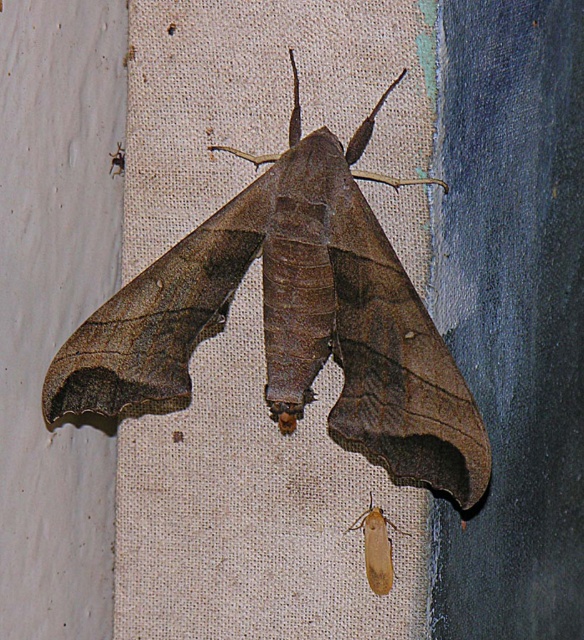
Question: Which object is closer to the camera taking this photo?

Choices:
 (A) brown matte moth at center
 (B) light brown fuzzy moth at lower right

Answer: (A)

Question: Observing the image, what is the correct spatial positioning of brown matte moth at center in reference to light brown fuzzy moth at lower right?

Choices:
 (A) above
 (B) below

Answer: (A)

Question: Can you confirm if brown matte moth at center is wider than light brown fuzzy moth at lower right?

Choices:
 (A) no
 (B) yes

Answer: (B)

Question: Which point appears farthest from the camera in this image?

Choices:
 (A) (363, 529)
 (B) (307, 152)

Answer: (A)

Question: Does brown matte moth at center appear on the right side of light brown fuzzy moth at lower right?

Choices:
 (A) no
 (B) yes

Answer: (A)

Question: Which of the following is the closest to the observer?

Choices:
 (A) (383, 589)
 (B) (484, 440)

Answer: (B)